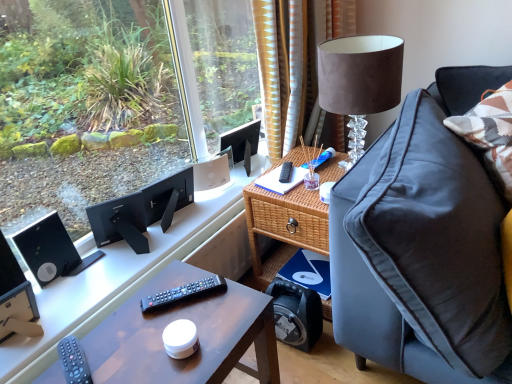
At what (x,y) coordinates should I click in order to perform the action: click on vacant area located to the right-hand side of matte black remote control at lower left, positioned as the third remote control in top-to-bottom order. Please return your answer as a coordinate pair (x, y). This screenshot has height=384, width=512. Looking at the image, I should click on pyautogui.click(x=136, y=353).